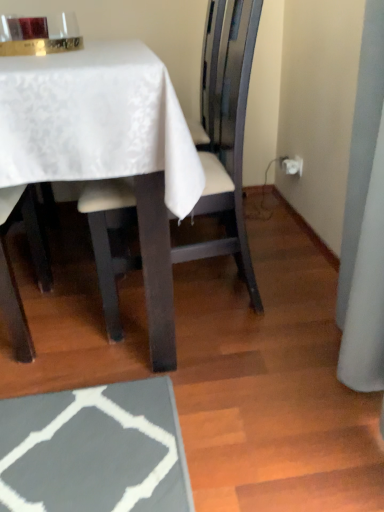
Locate an element on the screen. free point to the left of white leather chair at center is located at coordinates [59, 313].